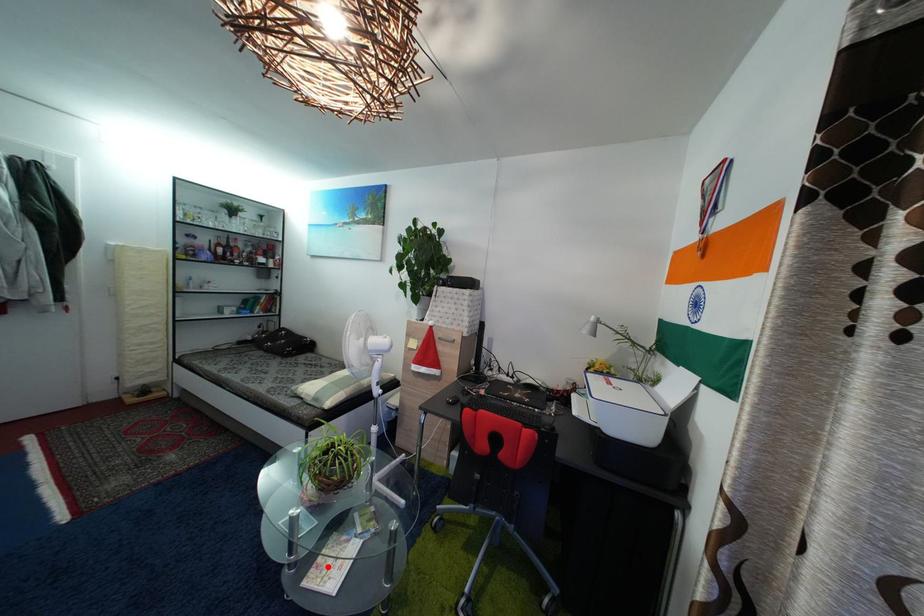
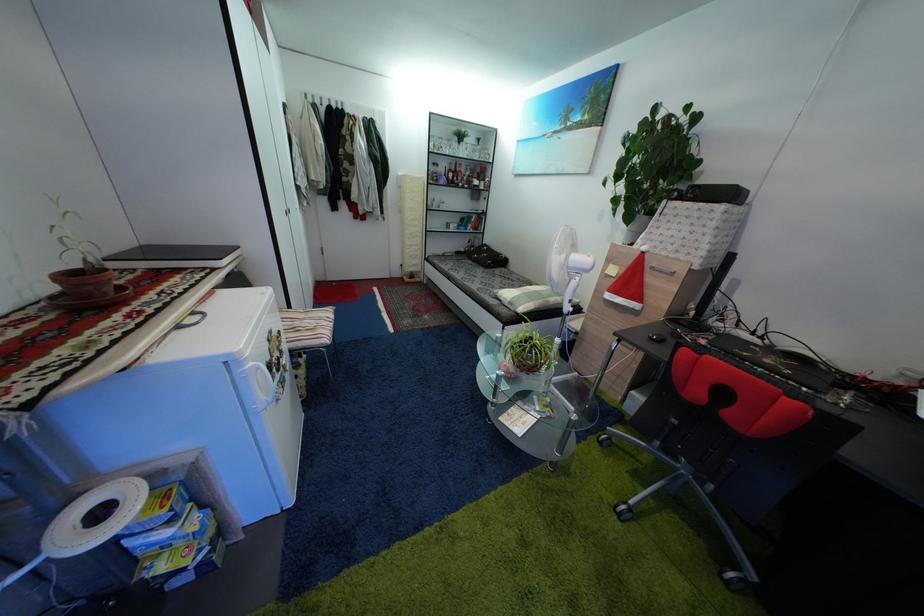
Question: I am providing you with two images of the same scene from different viewpoints. In image1, a red point is highlighted. Considering the same 3D point in image2, which of the following is correct?

Choices:
 (A) It is closer
 (B) It is farther

Answer: (A)